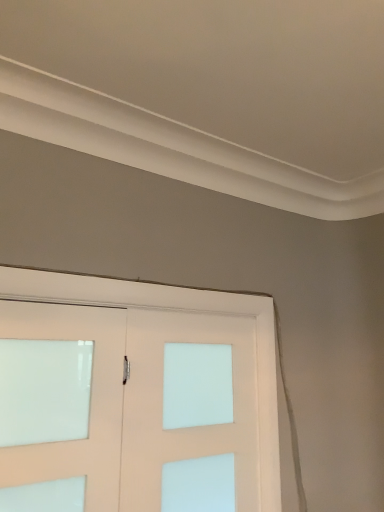
The image size is (384, 512). I want to click on white matte door at center, so click(139, 402).

The image size is (384, 512). What do you see at coordinates (139, 402) in the screenshot?
I see `white matte door at center` at bounding box center [139, 402].

The image size is (384, 512). What are the coordinates of `white matte door at center` in the screenshot? It's located at (139, 402).